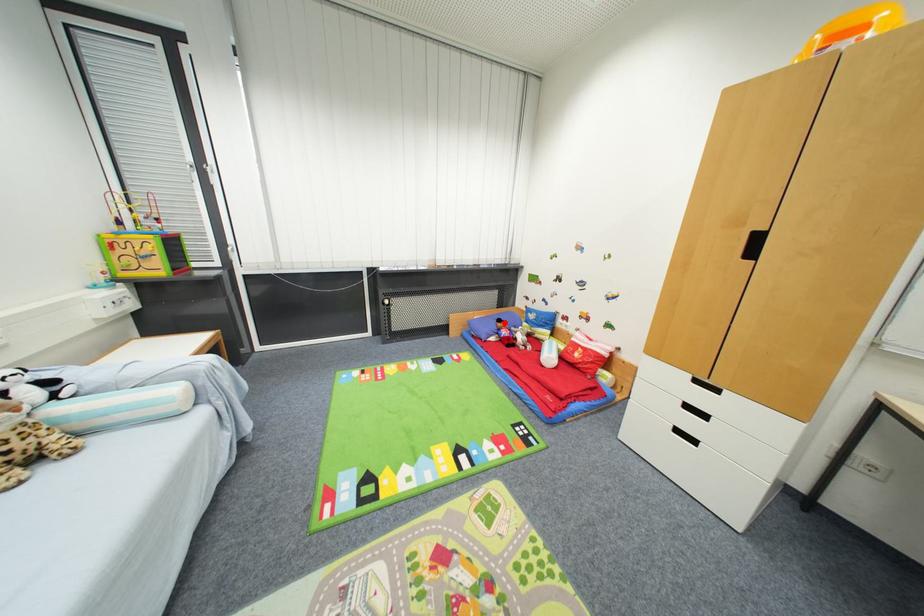
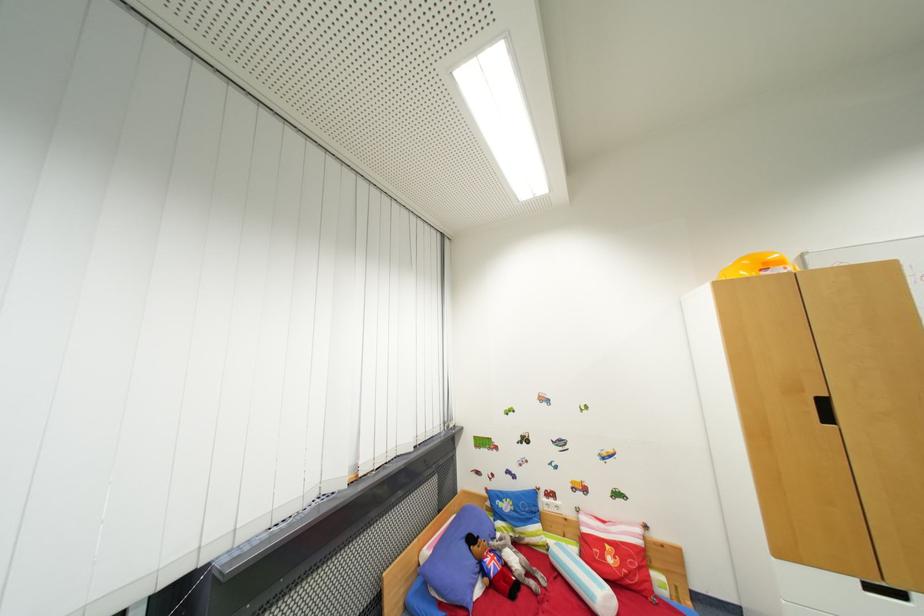
Question: I am providing you with two images of the same scene from different viewpoints. Given a red point in image1, look at the same physical point in image2. Is it:

Choices:
 (A) Closer to the viewpoint
 (B) Farther from the viewpoint

Answer: (A)